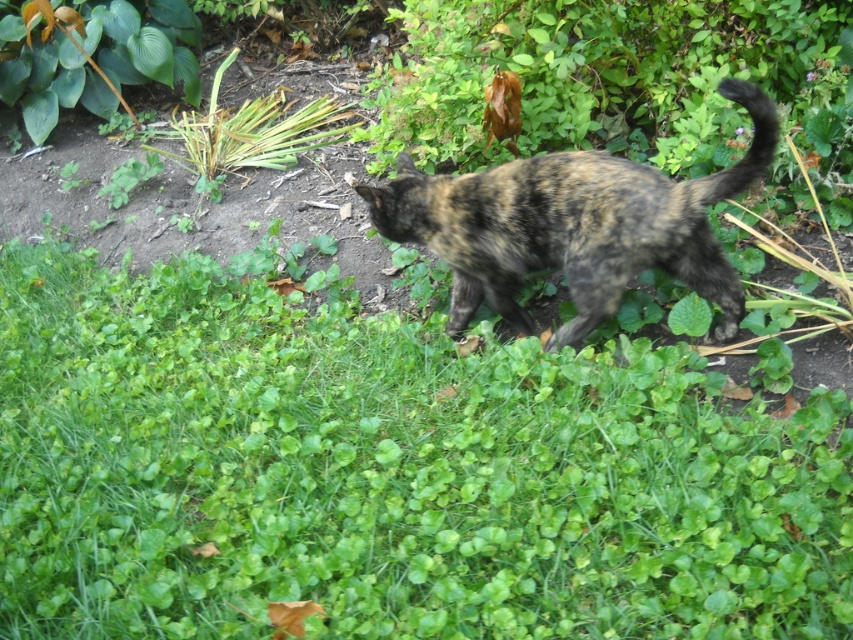
You are a drone operator trying to track the tortoiseshell cat in the garden. The cat is moving from left to right. To ensure the cat stays within the frame, you need to adjust the camera. Where should you position the camera so that the green leafy grass at center remains centered in the frame?

The green leafy grass at center is located at point [387,474] in 2D coordinates. To keep it centered, adjust the camera so that the center of the frame aligns with these coordinates.

You are a photographer trying to capture the tortoiseshell fur cat at center in the garden. You notice the green leafy grass at center is blocking your view. Can you move the grass to get a clear shot of the cat?

The green leafy grass at center is in front of the tortoiseshell fur cat at center, so you cannot move the grass as it is part of the natural environment and not something you can physically relocate to get a clear shot.